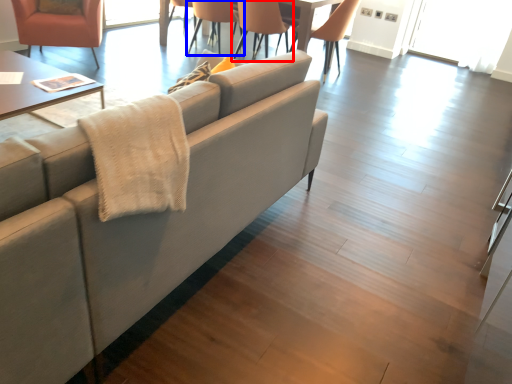
Question: Which of the following is the closest to the observer, chair (highlighted by a red box) or chair (highlighted by a blue box)?

Choices:
 (A) chair
 (B) chair

Answer: (A)